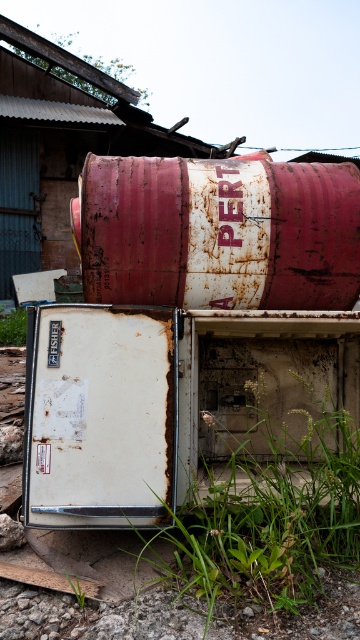
You are a photographer trying to capture a shot of the rusty metal barrel at upper center and the green grass at lower left. Since the barrel is blocking the view of the grass, can you move the barrel to get a clear shot of the grass?

The rusty metal barrel at upper center is positioned over green grass at lower left, so moving the barrel would allow you to see the green grass at lower left clearly.

You are standing in the abandoned area and need to walk from the green grass at lower left to the green grass at lower center. In which direction should you move?

You should move to the right to reach the green grass at lower center from the green grass at lower left because the green grass at lower center is to the right of the green grass at lower left.